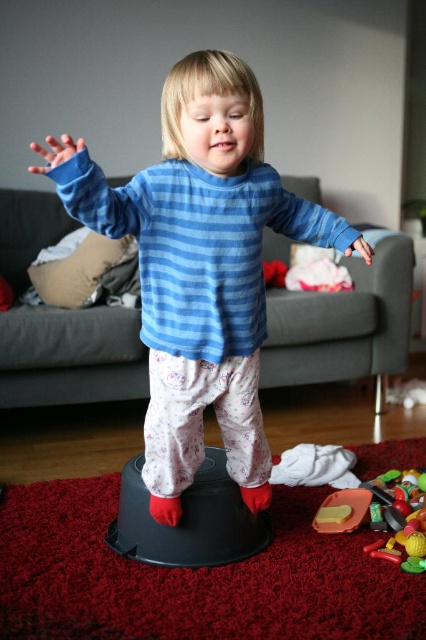
Can you confirm if blue striped sweater at center is smaller than rubberized plastic toy at lower right?

No, blue striped sweater at center is not smaller than rubberized plastic toy at lower right.

Does blue striped sweater at center have a greater width compared to rubberized plastic toy at lower right?

Correct, the width of blue striped sweater at center exceeds that of rubberized plastic toy at lower right.

Locate an element on the screen. The height and width of the screenshot is (640, 426). blue striped sweater at center is located at coordinates (199, 266).